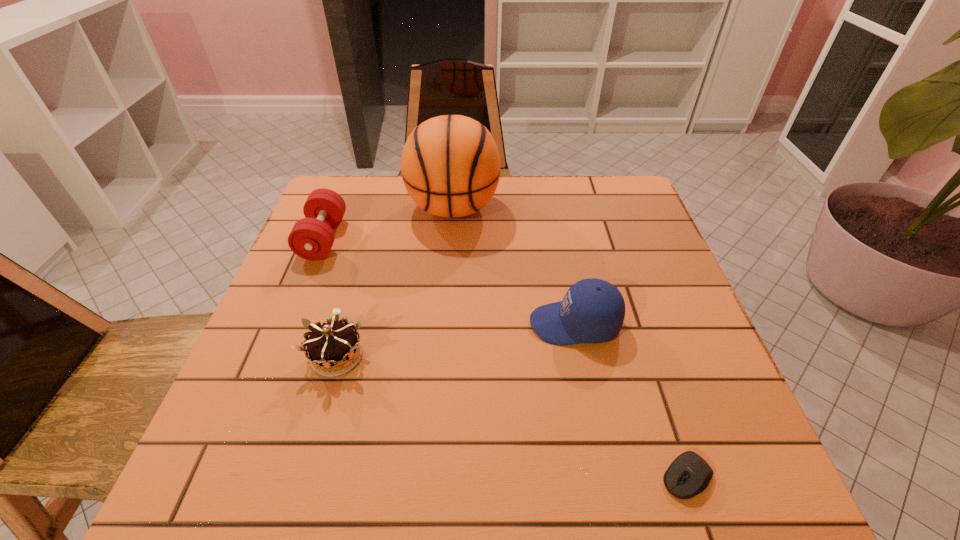
The height and width of the screenshot is (540, 960). What are the coordinates of `vacant area between the computer equipment and the cap` in the screenshot? It's located at (631, 401).

Find the location of a particular element. free spot between the leftmost object and the cap is located at coordinates (449, 281).

In order to click on free spot between the basketball and the fourth object from right to left in this screenshot , I will do `click(396, 282)`.

You are a GUI agent. You are given a task and a screenshot of the screen. Output one action in this format:
    pyautogui.click(x=<x>, y=<y>)
    Task: Click on the vacant area that lies between the leftmost object and the cap
    The width and height of the screenshot is (960, 540).
    Given the screenshot: What is the action you would take?
    pyautogui.click(x=449, y=281)

Locate an element on the screen. The image size is (960, 540). vacant point located between the leftmost object and the nearest object is located at coordinates (505, 358).

Locate an element on the screen. Image resolution: width=960 pixels, height=540 pixels. free area in between the shortest object and the crown is located at coordinates (512, 416).

You are a GUI agent. You are given a task and a screenshot of the screen. Output one action in this format:
    pyautogui.click(x=<x>, y=<y>)
    Task: Click on the unoccupied position between the second object from left to right and the cap
    Image resolution: width=960 pixels, height=540 pixels.
    Given the screenshot: What is the action you would take?
    pyautogui.click(x=456, y=340)

You are a GUI agent. You are given a task and a screenshot of the screen. Output one action in this format:
    pyautogui.click(x=<x>, y=<y>)
    Task: Click on the empty space between the crown and the leftmost object
    
    Given the screenshot: What is the action you would take?
    pyautogui.click(x=330, y=298)

Where is `free point between the fourth object from right to left and the cap`? This screenshot has width=960, height=540. free point between the fourth object from right to left and the cap is located at coordinates (456, 340).

Locate an element on the screen. This screenshot has height=540, width=960. the closest object relative to the nearest object is located at coordinates (592, 311).